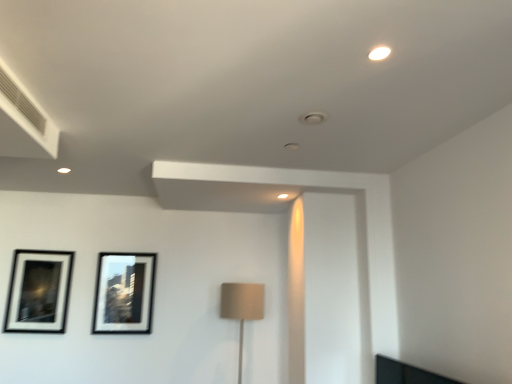
Question: Is black matte picture frame at upper left, which is the second picture frame from right to left, at the left side of matte black picture frame at center left, positioned as the first picture frame in right-to-left order?

Choices:
 (A) no
 (B) yes

Answer: (B)

Question: From a real-world perspective, is black matte picture frame at upper left, which is the second picture frame from right to left, below matte black picture frame at center left, positioned as the first picture frame in right-to-left order?

Choices:
 (A) no
 (B) yes

Answer: (B)

Question: Could matte black picture frame at center left, acting as the second picture frame starting from the left, be considered to be inside black matte picture frame at upper left, positioned as the 1th picture frame in left-to-right order?

Choices:
 (A) yes
 (B) no

Answer: (B)

Question: Can you confirm if black matte picture frame at upper left, positioned as the 1th picture frame in left-to-right order, is shorter than matte black picture frame at center left, acting as the second picture frame starting from the left?

Choices:
 (A) no
 (B) yes

Answer: (A)

Question: Can you confirm if black matte picture frame at upper left, positioned as the 1th picture frame in left-to-right order, is smaller than matte black picture frame at center left, acting as the second picture frame starting from the left?

Choices:
 (A) yes
 (B) no

Answer: (B)

Question: Considering the positions of matte black picture frame at center left, positioned as the first picture frame in right-to-left order, and beige fabric lampshade at center in the image, is matte black picture frame at center left, positioned as the first picture frame in right-to-left order, bigger or smaller than beige fabric lampshade at center?

Choices:
 (A) big
 (B) small

Answer: (B)

Question: In the image, is matte black picture frame at center left, positioned as the first picture frame in right-to-left order, positioned in front of or behind beige fabric lampshade at center?

Choices:
 (A) behind
 (B) front

Answer: (A)

Question: In terms of height, does matte black picture frame at center left, positioned as the first picture frame in right-to-left order, look taller or shorter compared to beige fabric lampshade at center?

Choices:
 (A) short
 (B) tall

Answer: (A)

Question: Considering the positions of matte black picture frame at center left, acting as the second picture frame starting from the left, and beige fabric lampshade at center in the image, is matte black picture frame at center left, acting as the second picture frame starting from the left, wider or thinner than beige fabric lampshade at center?

Choices:
 (A) thin
 (B) wide

Answer: (A)

Question: Would you say black matte picture frame at upper left, positioned as the 1th picture frame in left-to-right order, is inside or outside beige fabric lampshade at center?

Choices:
 (A) outside
 (B) inside

Answer: (A)

Question: From the image's perspective, relative to beige fabric lampshade at center, is black matte picture frame at upper left, which is the second picture frame from right to left, above or below?

Choices:
 (A) above
 (B) below

Answer: (A)

Question: Is point click(60, 258) closer or farther from the camera than point click(222, 316)?

Choices:
 (A) farther
 (B) closer

Answer: (A)

Question: Considering their positions, is black matte picture frame at upper left, positioned as the 1th picture frame in left-to-right order, located in front of or behind beige fabric lampshade at center?

Choices:
 (A) front
 (B) behind

Answer: (B)

Question: From a real-world perspective, is matte black picture frame at center left, acting as the second picture frame starting from the left, positioned above or below black matte picture frame at upper left, positioned as the 1th picture frame in left-to-right order?

Choices:
 (A) above
 (B) below

Answer: (A)

Question: Considering the positions of matte black picture frame at center left, positioned as the first picture frame in right-to-left order, and black matte picture frame at upper left, which is the second picture frame from right to left, in the image, is matte black picture frame at center left, positioned as the first picture frame in right-to-left order, wider or thinner than black matte picture frame at upper left, which is the second picture frame from right to left,?

Choices:
 (A) wide
 (B) thin

Answer: (B)